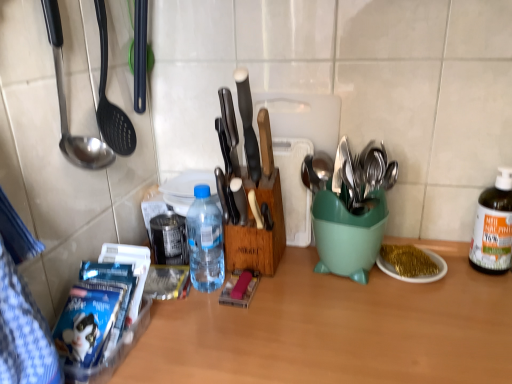
You are a GUI agent. You are given a task and a screenshot of the screen. Output one action in this format:
    pyautogui.click(x=<x>, y=<y>)
    Task: Click on the vacant space to the right of translucent plastic bottle at center, marked as the 2th bottle in a right-to-left arrangement
    
    Given the screenshot: What is the action you would take?
    pyautogui.click(x=300, y=301)